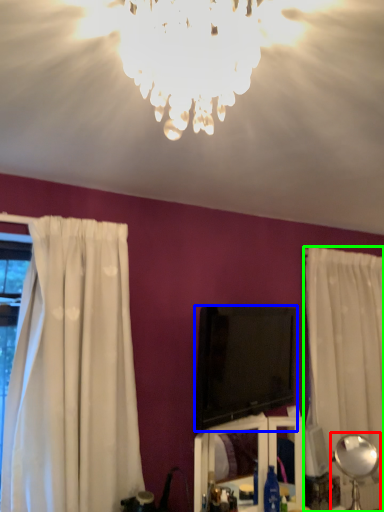
Question: Based on their relative distances, which object is farther from lamp (highlighted by a red box)? Choose from television (highlighted by a blue box) and curtain (highlighted by a green box).

Choices:
 (A) television
 (B) curtain

Answer: (A)